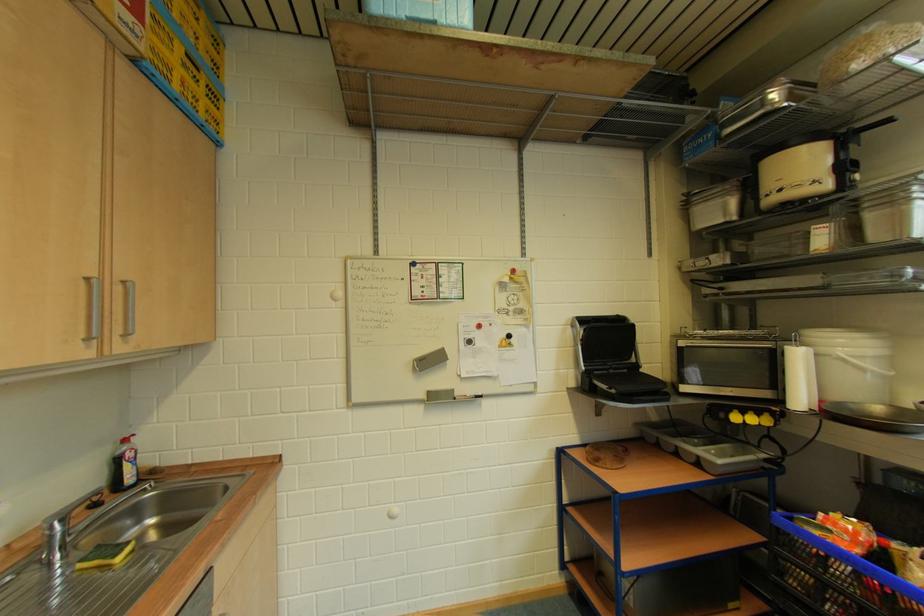
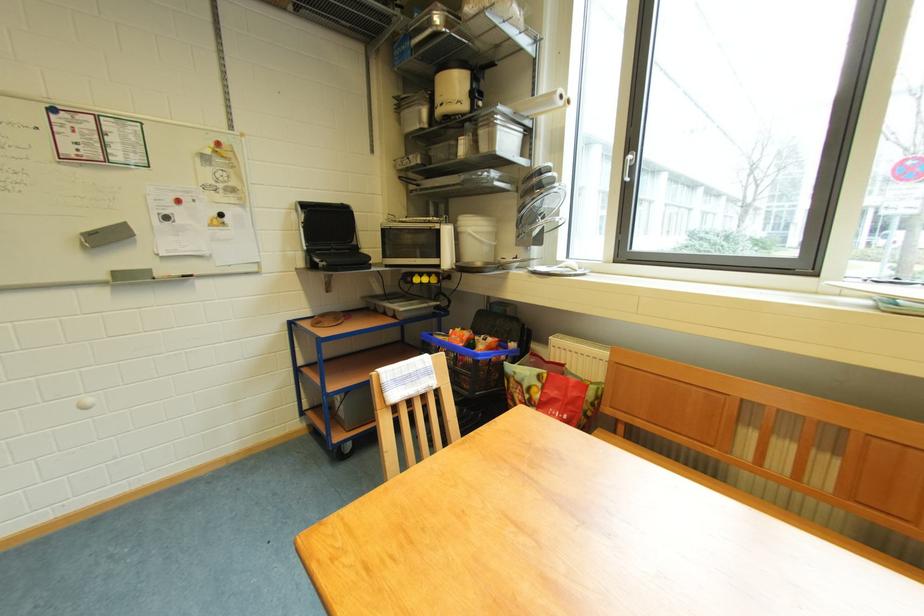
In the second image, find the point that corresponds to point 728,419 in the first image.

(417, 282)